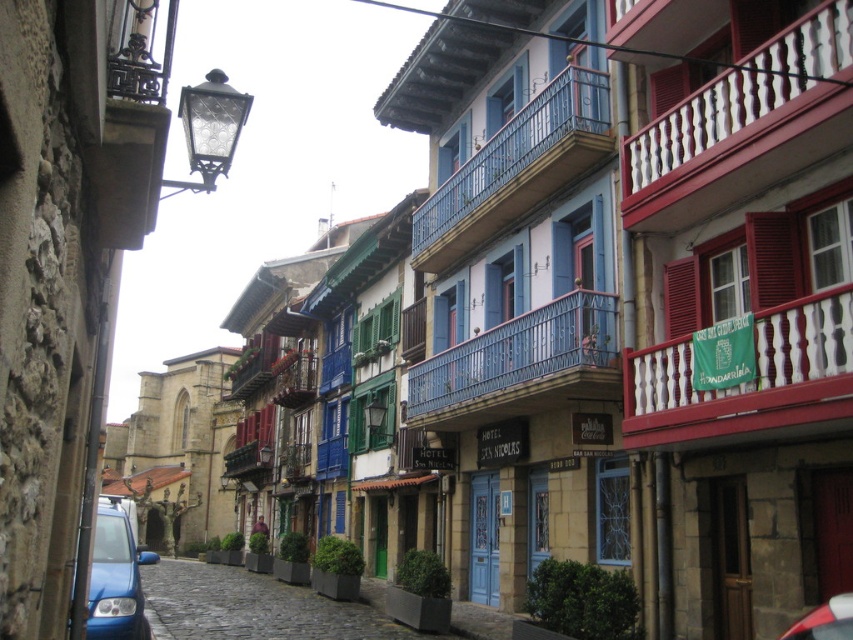
Who is positioned more to the left, blue painted metal railing at upper center or metallic red car at lower right?

blue painted metal railing at upper center

This screenshot has width=853, height=640. Find the location of `blue painted metal railing at upper center`. blue painted metal railing at upper center is located at coordinates (515, 168).

Where is `blue painted metal railing at upper center`? blue painted metal railing at upper center is located at coordinates (515, 168).

Can you confirm if white wooden balcony at right is wider than metallic red car at lower right?

Yes, white wooden balcony at right is wider than metallic red car at lower right.

Is point (741, 394) closer to viewer compared to point (820, 612)?

No, (741, 394) is further to viewer.

Where is `white wooden balcony at right`? The image size is (853, 640). white wooden balcony at right is located at coordinates (749, 380).

Between white wooden railing at upper right and blue matte car at lower left, which one has less height?

white wooden railing at upper right

Who is more distant from viewer, (706, 182) or (149, 556)?

Positioned behind is point (149, 556).

Locate an element on the screen. The width and height of the screenshot is (853, 640). white wooden railing at upper right is located at coordinates (744, 125).